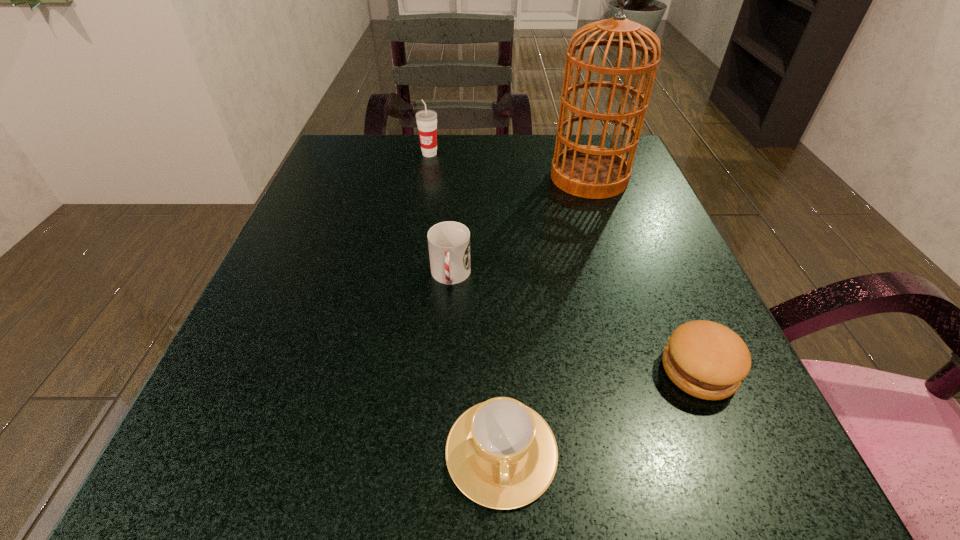
Where is `vacant space at the right edge of the desktop`? The height and width of the screenshot is (540, 960). vacant space at the right edge of the desktop is located at coordinates (667, 251).

In the image, there is a desktop. Where is `vacant area at the far right corner`? This screenshot has height=540, width=960. vacant area at the far right corner is located at coordinates (637, 183).

Image resolution: width=960 pixels, height=540 pixels. Identify the location of free space at the near right corner of the desktop. (714, 468).

Image resolution: width=960 pixels, height=540 pixels. I want to click on free space between the second tallest object and the hamburger, so click(x=564, y=262).

The width and height of the screenshot is (960, 540). I want to click on free space between the hamburger and the tallest object, so click(644, 274).

I want to click on unoccupied area between the third nearest object and the shortest cup, so (x=476, y=364).

At what (x,y) coordinates should I click in order to perform the action: click on vacant space that is in between the birdcage and the second tallest cup. Please return your answer as a coordinate pair (x, y). Looking at the image, I should click on (519, 227).

Locate an element on the screen. This screenshot has height=540, width=960. free space between the birdcage and the third farthest object is located at coordinates (519, 227).

Locate an element on the screen. The width and height of the screenshot is (960, 540). vacant point located between the farthest cup and the nearest cup is located at coordinates (466, 302).

Identify the location of free space that is in between the shortest cup and the second tallest cup. (476, 364).